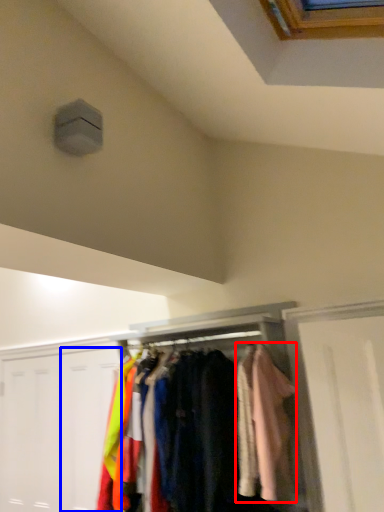
Question: Which object appears closest to the camera in this image, clothing (highlighted by a red box) or door (highlighted by a blue box)?

Choices:
 (A) clothing
 (B) door

Answer: (A)